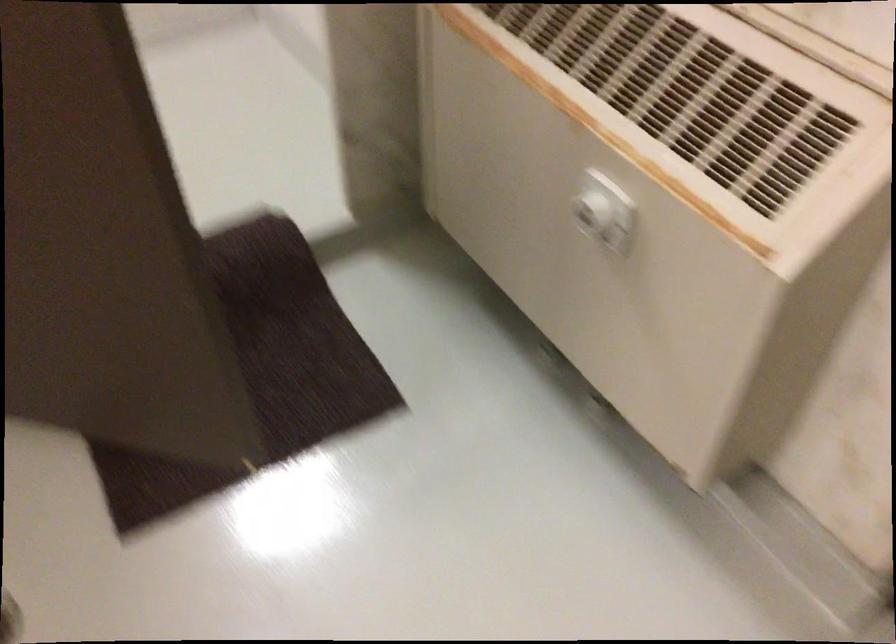
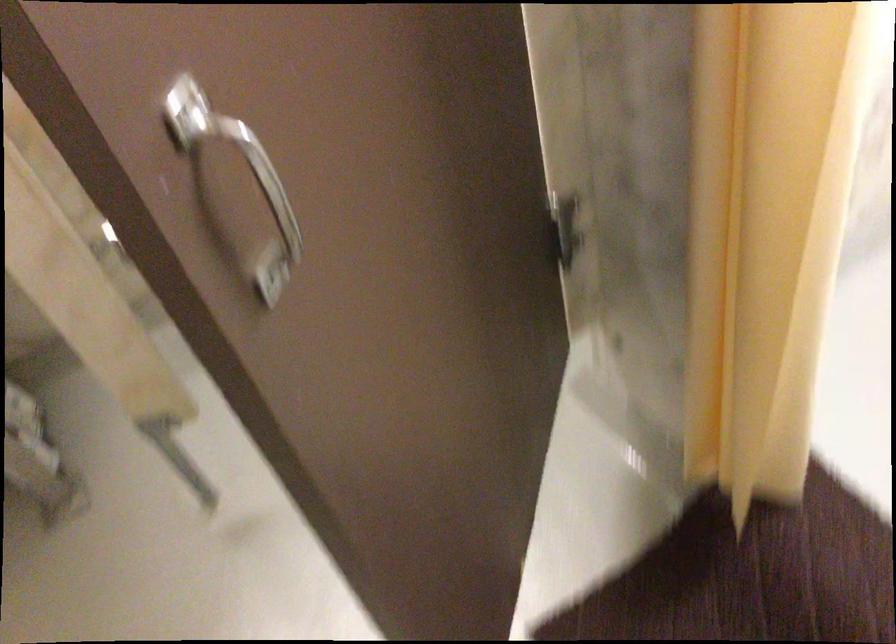
Based on the continuous images, in which direction is the camera rotating?

The rotation direction of the camera is left-down.